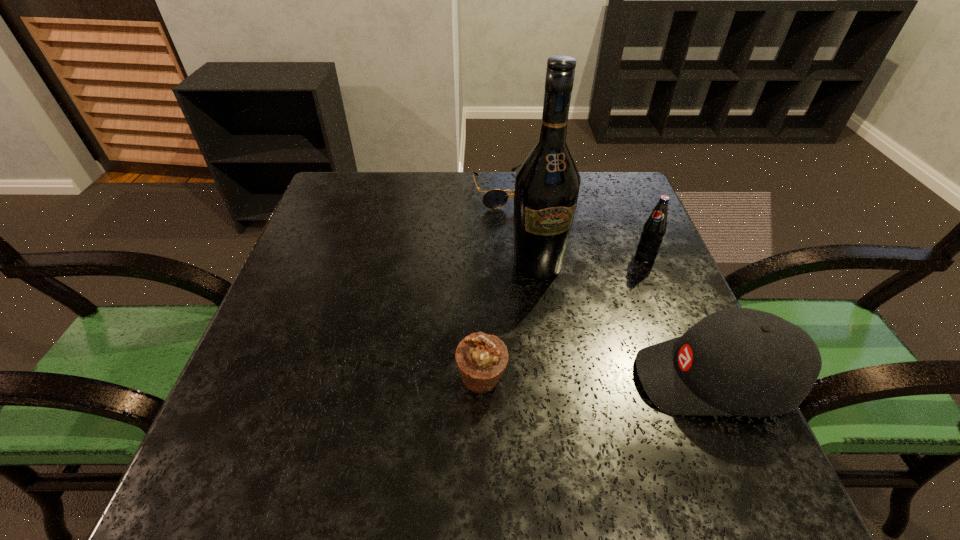
Locate an element on the screen. Image resolution: width=960 pixels, height=540 pixels. muffin at the near edge is located at coordinates (481, 359).

You are a GUI agent. You are given a task and a screenshot of the screen. Output one action in this format:
    pyautogui.click(x=<x>, y=<y>)
    Task: Click on the baseball cap that is positioned at the near edge
    
    Given the screenshot: What is the action you would take?
    point(735,362)

Find the location of a particular element. The width and height of the screenshot is (960, 540). baseball cap that is at the right edge is located at coordinates (735, 362).

In order to click on pop that is at the right edge in this screenshot , I will do `click(654, 228)`.

The height and width of the screenshot is (540, 960). In order to click on object present at the near right corner in this screenshot , I will do `click(735, 362)`.

Identify the location of vacant space at the far edge of the desktop. (439, 178).

Find the location of a particular element. This screenshot has width=960, height=540. vacant space at the near edge of the desktop is located at coordinates (552, 422).

Where is `blank space at the left edge of the desktop`? The width and height of the screenshot is (960, 540). blank space at the left edge of the desktop is located at coordinates (325, 358).

The image size is (960, 540). I want to click on vacant area at the right edge, so click(642, 294).

In the image, there is a desktop. At what (x,y) coordinates should I click in order to perform the action: click on vacant region at the far left corner. Please return your answer as a coordinate pair (x, y). Looking at the image, I should click on (354, 202).